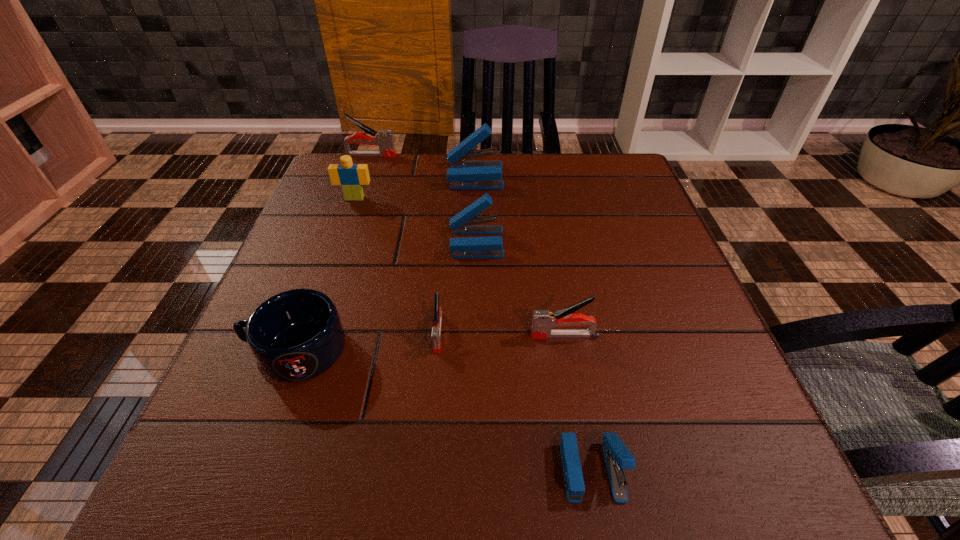
Identify the location of vacant space at the near edge of the desktop. The image size is (960, 540). (396, 499).

At what (x,y) coordinates should I click in order to perform the action: click on blank space at the left edge. Please return your answer as a coordinate pair (x, y). This screenshot has width=960, height=540. Looking at the image, I should click on (348, 230).

This screenshot has width=960, height=540. I want to click on vacant space at the right edge of the desktop, so click(x=688, y=430).

In the image, there is a desktop. At what (x,y) coordinates should I click in order to perform the action: click on free space at the far left corner. Please return your answer as a coordinate pair (x, y). This screenshot has height=540, width=960. Looking at the image, I should click on (379, 173).

In the image, there is a desktop. In order to click on free space at the far right corner in this screenshot , I will do `click(580, 163)`.

This screenshot has height=540, width=960. What are the coordinates of `vacant point located between the nearest stapler and the farthest object` in the screenshot? It's located at (481, 313).

Locate an element on the screen. This screenshot has width=960, height=540. vacant area between the rightmost gray stapler and the smallest gray stapler is located at coordinates (501, 334).

Locate an element on the screen. The height and width of the screenshot is (540, 960). free point between the seventh nearest object and the second biggest gray stapler is located at coordinates (519, 256).

Locate an element on the screen. vacant point located between the mug and the second farthest stapler is located at coordinates (386, 263).

This screenshot has height=540, width=960. Identify the location of free space between the second biggest blue stapler and the smallest blue stapler. (534, 356).